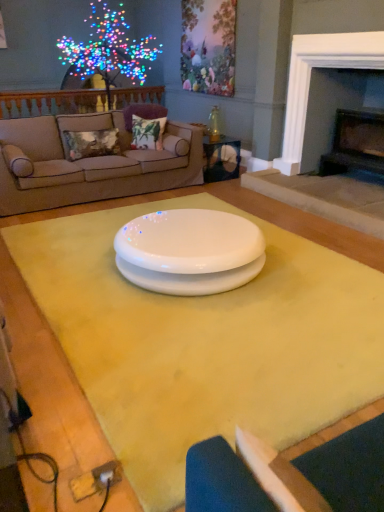
Where is `vacant region to the left of white glossy plate at center`? The width and height of the screenshot is (384, 512). vacant region to the left of white glossy plate at center is located at coordinates (71, 259).